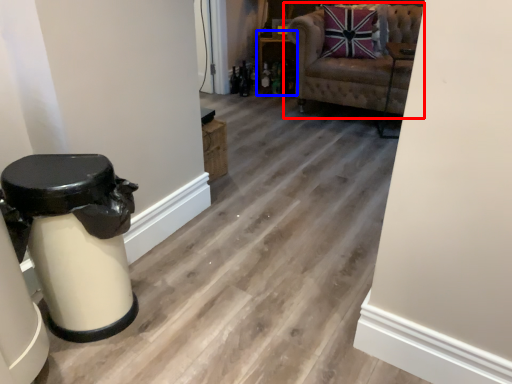
Question: Which object appears closest to the camera in this image, chair (highlighted by a red box) or furniture (highlighted by a blue box)?

Choices:
 (A) chair
 (B) furniture

Answer: (A)